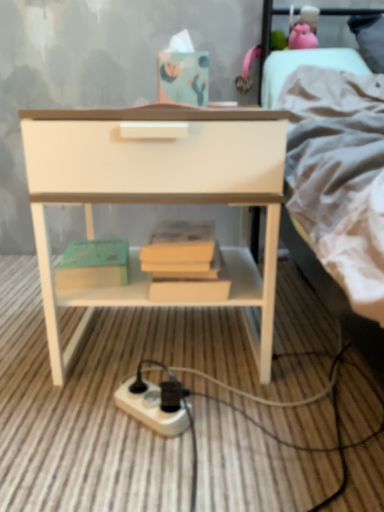
At what (x,y) coordinates should I click in order to perform the action: click on vacant space that is to the left of white plastic power plugs and sockets at lower center. Please return your answer as a coordinate pair (x, y). The width and height of the screenshot is (384, 512). Looking at the image, I should click on (66, 418).